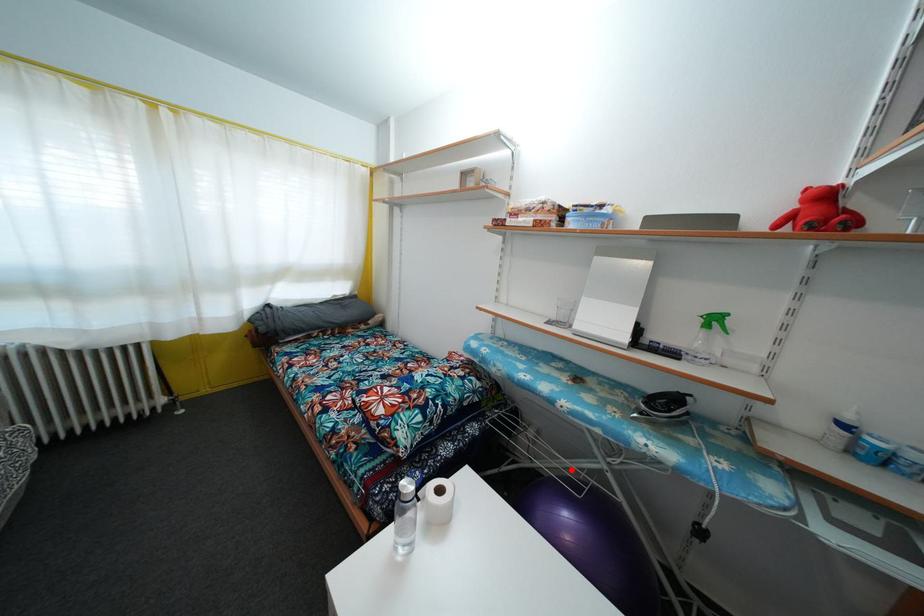
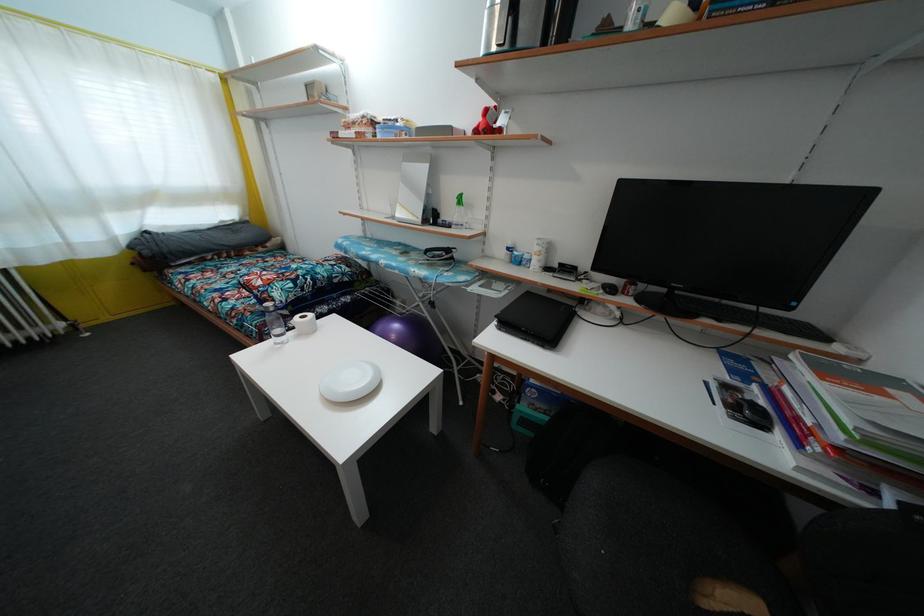
In the second image, find the point that corresponds to the highlighted location in the first image.

(411, 315)